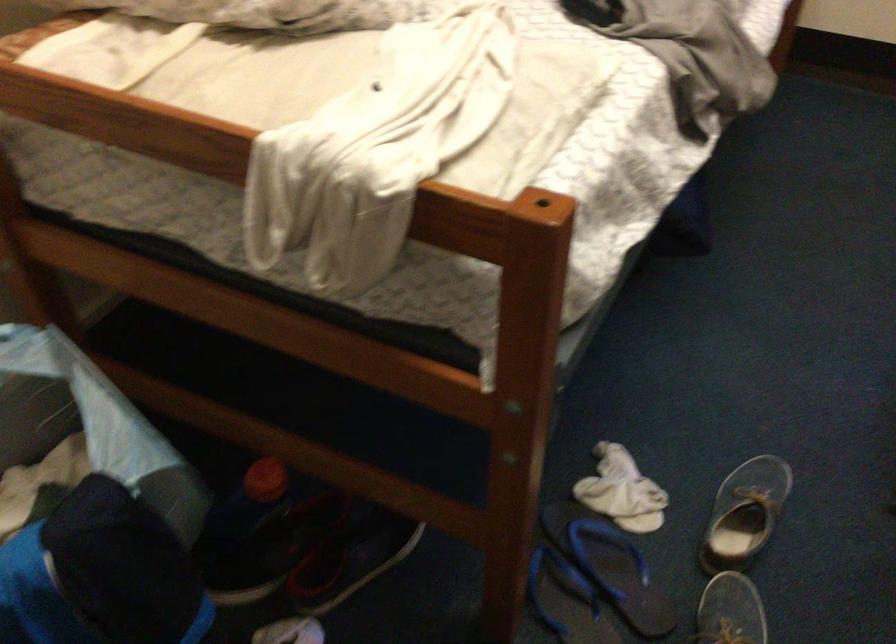
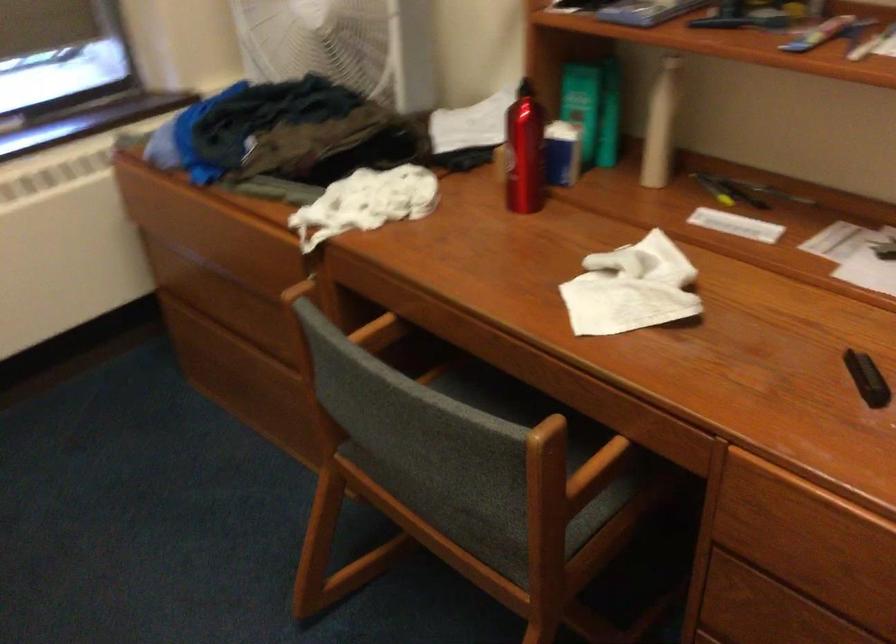
Question: How did the camera likely rotate?

Choices:
 (A) Left
 (B) Right
 (C) Up
 (D) Down

Answer: (B)